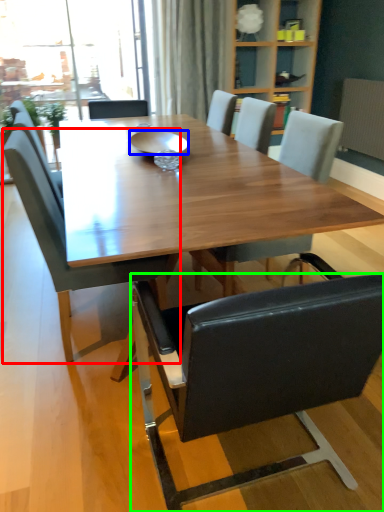
Question: Estimate the real-world distances between objects in this image. Which object is closer to chair (highlighted by a red box), bowl (highlighted by a blue box) or chair (highlighted by a green box)?

Choices:
 (A) bowl
 (B) chair

Answer: (B)